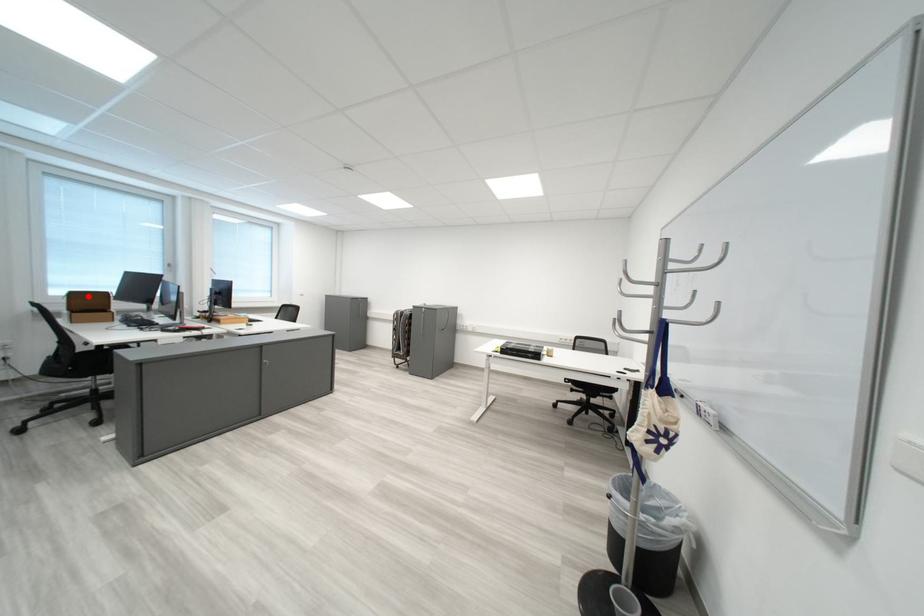
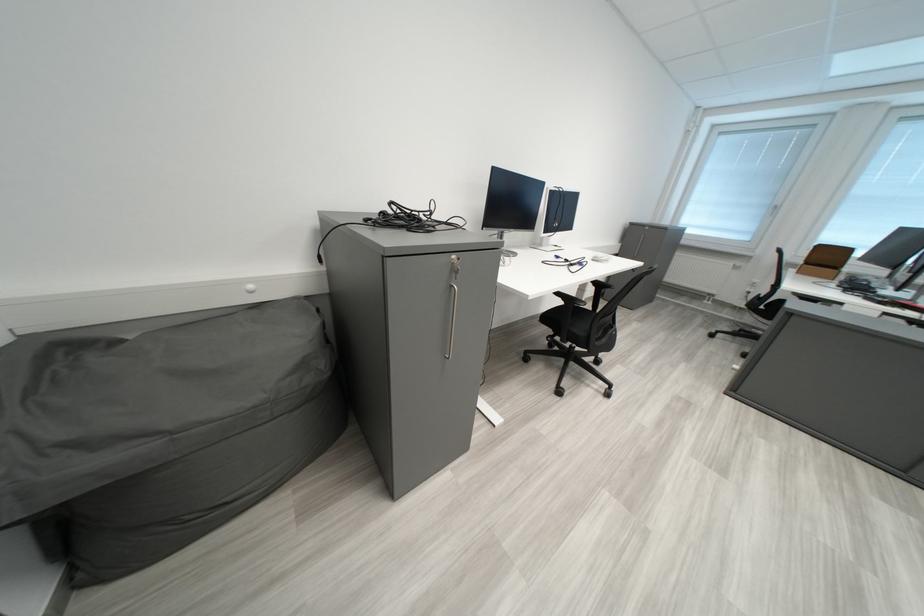
Question: I am providing you with two images of the same scene from different viewpoints. Given a red point in image1, look at the same physical point in image2. Is it:

Choices:
 (A) Closer to the viewpoint
 (B) Farther from the viewpoint

Answer: (B)